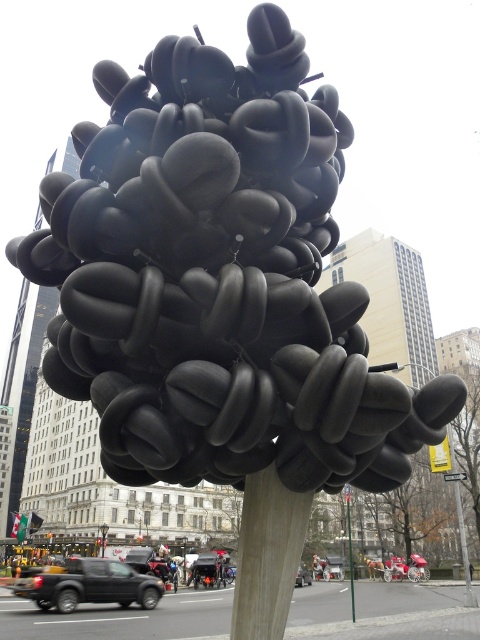
You are a city planner evaluating the placement of the matte black sculpture at center and the smooth gray pole at center. Based on the scene, can you confirm if the sculpture is positioned above the pole?

The matte black sculpture at center is located above the smooth gray pole at center, so yes, the sculpture is positioned above the pole.

You are an artist planning to photograph the matte black sculpture at center and the smooth gray pole at center from a distance. Based on their sizes, which object will appear larger in the photo?

The matte black sculpture at center will appear larger in the photo because its width surpasses that of the smooth gray pole at center.

You are standing at the base of the wooden pole holding the balloon sculpture. You notice two points marked in the scene. Which point is closer to you, point (233, 212) or point (348, 532)?

Point (233, 212) is closer to you because it is in front of point (348, 532).